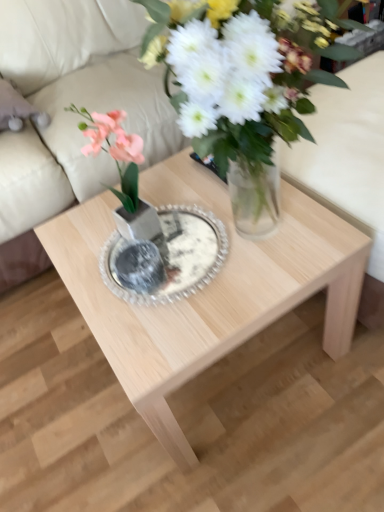
Identify the location of vacant area located to the right-hand side of pink silk flower at center. (210, 196).